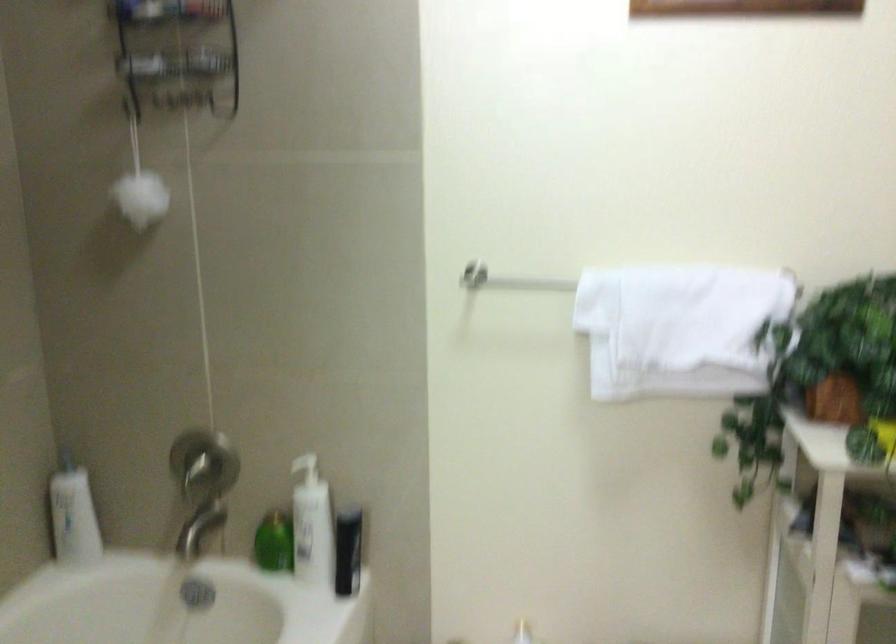
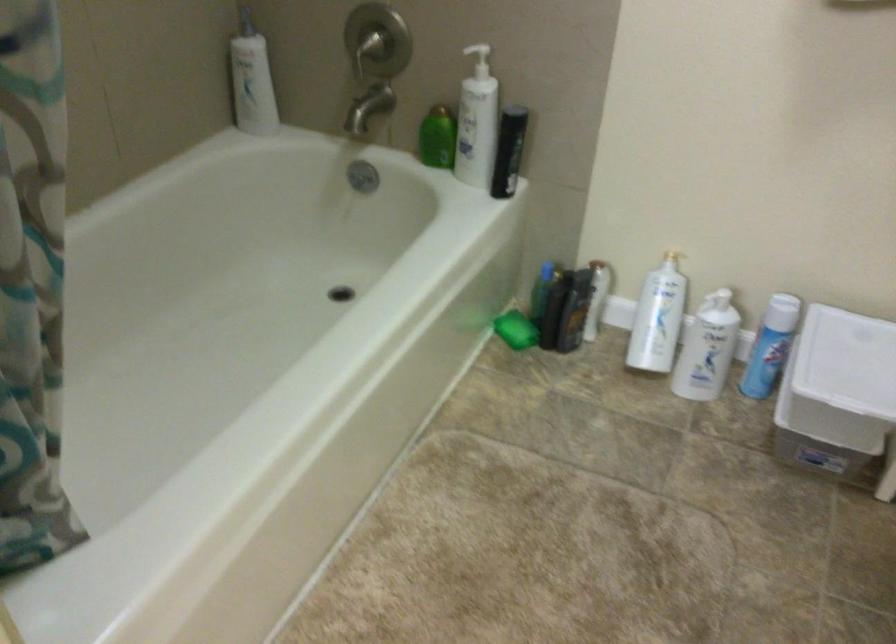
In the second image, find the point that corresponds to the point at 203,526 in the first image.

(368, 108)